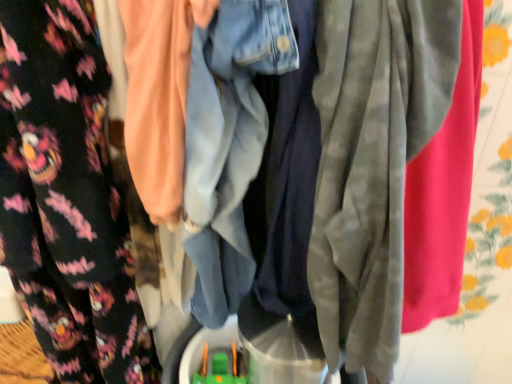
Question: Considering the relative positions of green plastic toy at center and floral fleece pants at left in the image provided, is green plastic toy at center behind floral fleece pants at left?

Choices:
 (A) yes
 (B) no

Answer: (A)

Question: From a real-world perspective, is green plastic toy at center physically below floral fleece pants at left?

Choices:
 (A) no
 (B) yes

Answer: (B)

Question: Is green plastic toy at center at the right side of floral fleece pants at left?

Choices:
 (A) no
 (B) yes

Answer: (B)

Question: Is green plastic toy at center not within floral fleece pants at left?

Choices:
 (A) yes
 (B) no

Answer: (A)

Question: Can you confirm if green plastic toy at center is positioned to the left of floral fleece pants at left?

Choices:
 (A) yes
 (B) no

Answer: (B)

Question: From a real-world perspective, is green plastic toy at center on floral fleece pants at left?

Choices:
 (A) yes
 (B) no

Answer: (B)

Question: Is floral fleece pants at left smaller than green plastic toy at center?

Choices:
 (A) no
 (B) yes

Answer: (A)

Question: From a real-world perspective, is floral fleece pants at left below green plastic toy at center?

Choices:
 (A) yes
 (B) no

Answer: (B)

Question: Are floral fleece pants at left and green plastic toy at center located far from each other?

Choices:
 (A) yes
 (B) no

Answer: (B)

Question: Does floral fleece pants at left lie behind green plastic toy at center?

Choices:
 (A) no
 (B) yes

Answer: (A)

Question: Is floral fleece pants at left facing towards green plastic toy at center?

Choices:
 (A) no
 (B) yes

Answer: (A)

Question: Is floral fleece pants at left wider than green plastic toy at center?

Choices:
 (A) yes
 (B) no

Answer: (A)

Question: In terms of height, does floral fleece pants at left look taller or shorter compared to green plastic toy at center?

Choices:
 (A) tall
 (B) short

Answer: (A)